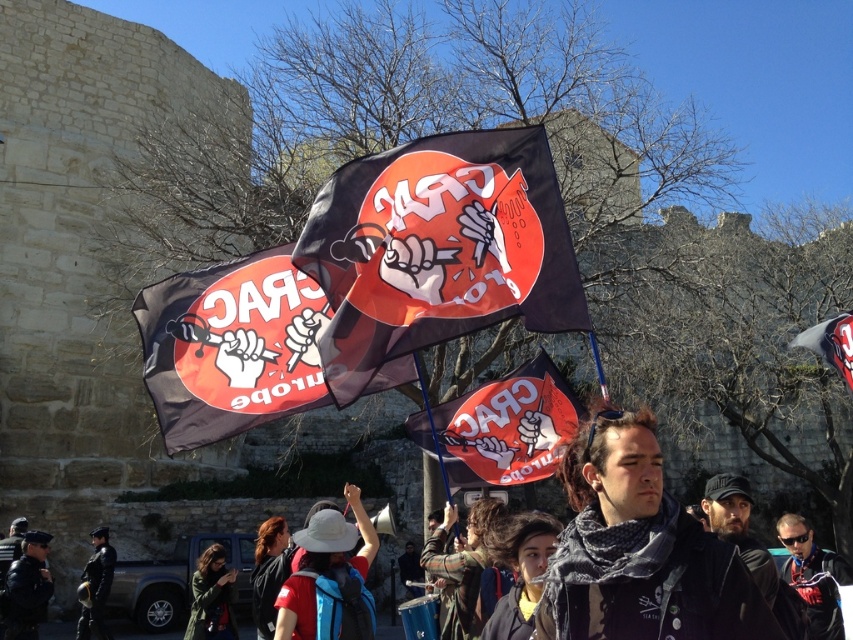
Does point (430, 552) lie in front of point (94, 588)?

Yes, point (430, 552) is closer to viewer.

Find the location of a particular element. This screenshot has width=853, height=640. flannel shirt at center is located at coordinates (460, 566).

At what (x,y) coordinates should I click in order to perform the action: click on flannel shirt at center. Please return your answer as a coordinate pair (x, y). Looking at the image, I should click on (460, 566).

The height and width of the screenshot is (640, 853). What are the coordinates of `flannel shirt at center` in the screenshot? It's located at (460, 566).

Does dark gray scarf at center lie in front of red fabric flag at upper right?

Yes, dark gray scarf at center is closer to the viewer.

Which is above, dark gray scarf at center or red fabric flag at upper right?

red fabric flag at upper right is above.

Which is in front, point (646, 620) or point (833, 365)?

Point (646, 620) is in front.

The width and height of the screenshot is (853, 640). I want to click on dark gray scarf at center, so click(639, 548).

Can you confirm if green fabric jacket at lower left is shorter than red fabric flag at upper right?

Correct, green fabric jacket at lower left is not as tall as red fabric flag at upper right.

At what (x,y) coordinates should I click in order to perform the action: click on green fabric jacket at lower left. Please return your answer as a coordinate pair (x, y). Looking at the image, I should click on (212, 596).